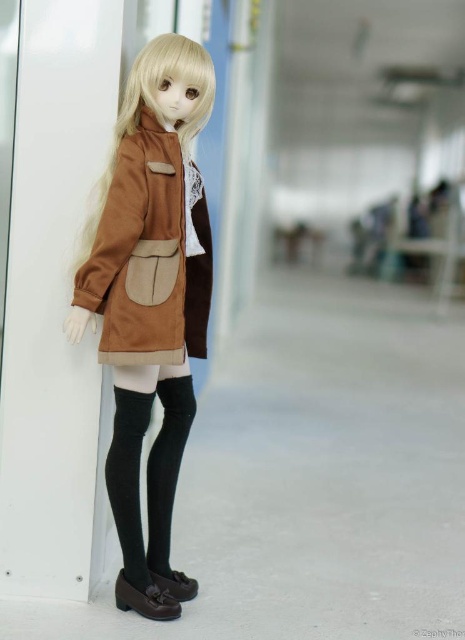
Question: Considering the relative positions of matte brown coat at center and black knit tights at lower center in the image provided, where is matte brown coat at center located with respect to black knit tights at lower center?

Choices:
 (A) above
 (B) below

Answer: (A)

Question: Which object is positioned closest to the black smooth socks at lower center?

Choices:
 (A) matte brown coat at center
 (B) brown suede jacket at center

Answer: (A)

Question: Estimate the real-world distances between objects in this image. Which object is closer to the black knit tights at lower center?

Choices:
 (A) brown suede jacket at center
 (B) black smooth socks at lower center
 (C) matte brown coat at center

Answer: (B)

Question: Based on their relative distances, which object is farther from the black knit tights at lower center?

Choices:
 (A) matte brown coat at center
 (B) black smooth socks at lower center
 (C) brown suede jacket at center

Answer: (C)

Question: Is matte brown coat at center further to camera compared to brown suede jacket at center?

Choices:
 (A) yes
 (B) no

Answer: (B)

Question: Is black knit tights at lower center bigger than black smooth socks at lower center?

Choices:
 (A) no
 (B) yes

Answer: (B)